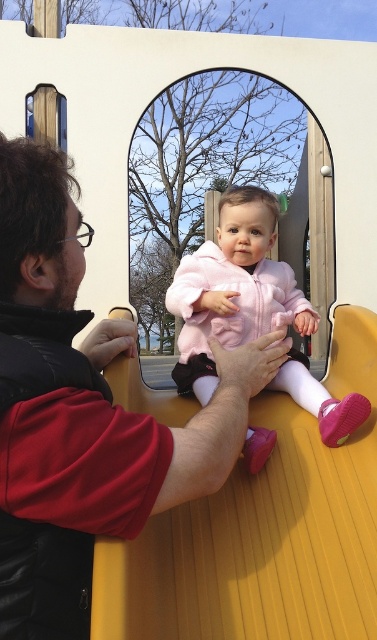
You are a photographer standing 1.2 meters away from the camera. You want to adjust your position so that you can see the matte black jacket at left in your viewfinder without moving the camera. Is it possible?

The matte black jacket at left and camera are 1.17 meters apart from each other. Since you are standing 1.2 meters away from the camera, you can adjust your position to see the matte black jacket at left in your viewfinder without moving the camera because your distance is slightly greater than the jacket to camera distance.

You are a photographer standing in the playground scene. You need to position a tripod so it doesn not block the view of the matte black jacket at left and the matte yellow slide at center. Given that the tripod is 1.8 meters tall, will its height interfere with capturing both objects in the frame?

The matte black jacket at left is taller than the matte yellow slide at center. Since the tripod is 1.8 meters tall, if the jacket is taller than 1.8 meters, the tripod might block the view. However, without specific height measurements for the objects, we can only state the relative heights. The answer depends on whether the jacket exceeds the tripod height.